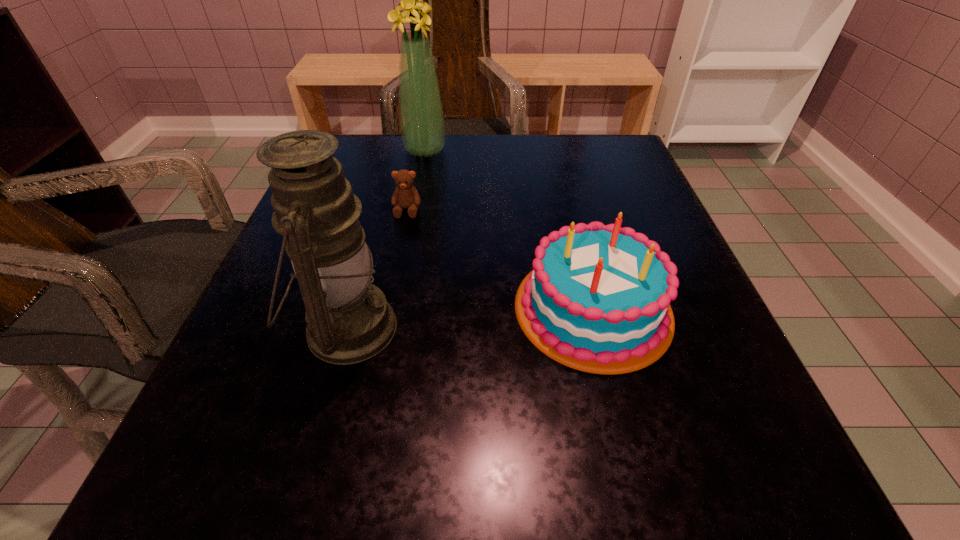
Find the location of a particular element. empty location between the teddy bear and the bouquet is located at coordinates (416, 180).

This screenshot has width=960, height=540. Find the location of `free area in between the farthest object and the rightmost object`. free area in between the farthest object and the rightmost object is located at coordinates (509, 230).

At what (x,y) coordinates should I click in order to perform the action: click on vacant area that lies between the shortest object and the oil lamp. Please return your answer as a coordinate pair (x, y). The height and width of the screenshot is (540, 960). Looking at the image, I should click on (377, 269).

Where is `vacant area that lies between the oil lamp and the teddy bear`? Image resolution: width=960 pixels, height=540 pixels. vacant area that lies between the oil lamp and the teddy bear is located at coordinates (377, 269).

I want to click on free space between the farthest object and the second farthest object, so click(x=416, y=180).

The height and width of the screenshot is (540, 960). I want to click on free space between the teddy bear and the third shortest object, so click(377, 269).

Find the location of a particular element. unoccupied area between the shortest object and the rightmost object is located at coordinates coord(500,259).

The height and width of the screenshot is (540, 960). I want to click on free space between the birthday cake and the third nearest object, so click(500, 259).

Where is `free space between the third tallest object and the second tallest object`? The height and width of the screenshot is (540, 960). free space between the third tallest object and the second tallest object is located at coordinates 470,319.

The width and height of the screenshot is (960, 540). I want to click on object that stands as the closest to the bouquet, so click(x=405, y=195).